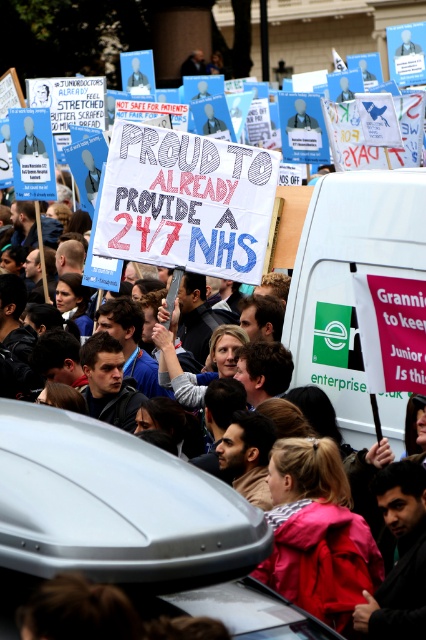
You are a photographer standing at the origin point of the image. You want to capture a photo of the white fabric crowd at center. What are the coordinates you should aim your camera at?

The coordinates to aim your camera at are 0.806 on the x axis and 0.289 on the y axis.